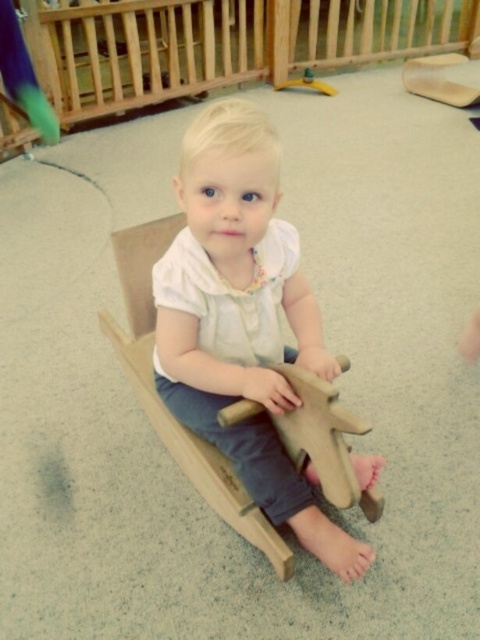
Question: Considering the relative positions of wooden rocking horse at center and wooden horse at center in the image provided, where is wooden rocking horse at center located with respect to wooden horse at center?

Choices:
 (A) right
 (B) left

Answer: (B)

Question: Which point is closer to the camera?

Choices:
 (A) wooden rocking horse at center
 (B) wooden horse at center

Answer: (A)

Question: Does wooden rocking horse at center appear on the right side of wooden horse at center?

Choices:
 (A) no
 (B) yes

Answer: (A)

Question: Which of the following is the farthest from the observer?

Choices:
 (A) wooden horse at center
 (B) wooden rocking horse at center

Answer: (A)

Question: Does wooden rocking horse at center have a lesser width compared to wooden horse at center?

Choices:
 (A) yes
 (B) no

Answer: (B)